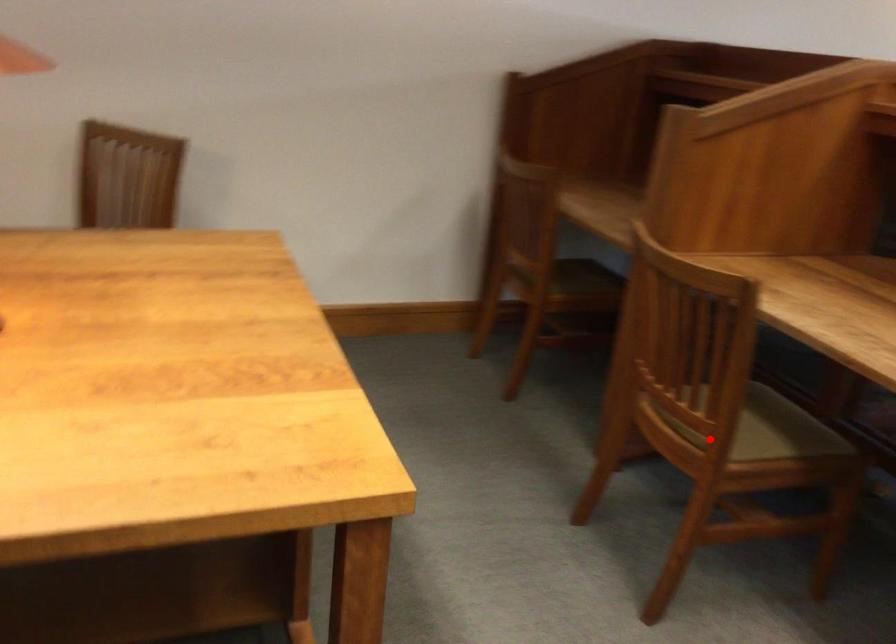
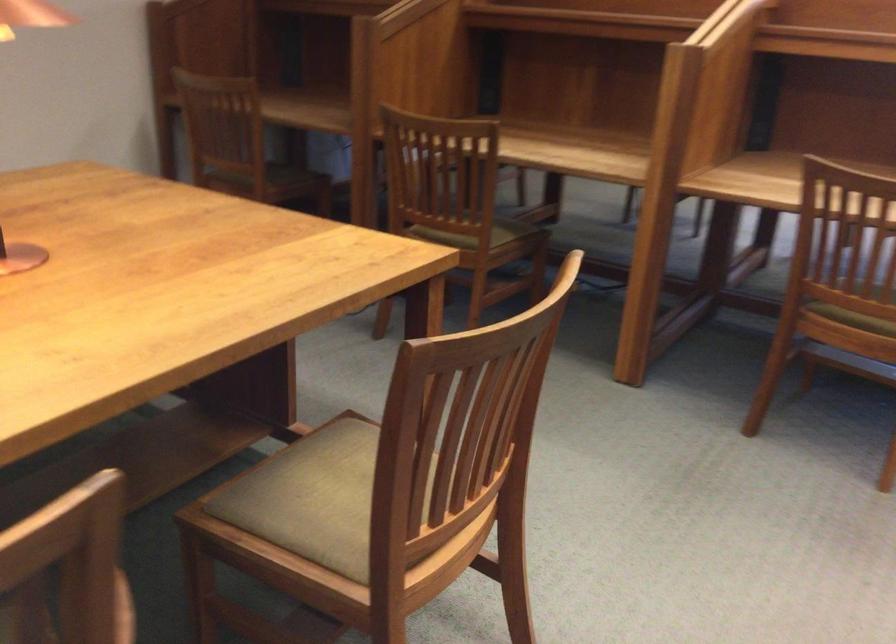
Question: I am providing you with two images of the same scene from different viewpoints. In image1, a red point is highlighted. Considering the same 3D point in image2, which of the following is correct?

Choices:
 (A) It is closer
 (B) It is farther

Answer: (B)